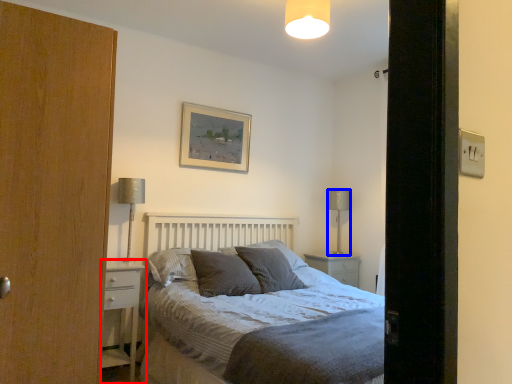
Question: Which point is further to the camera, nightstand (highlighted by a red box) or table lamp (highlighted by a blue box)?

Choices:
 (A) nightstand
 (B) table lamp

Answer: (B)